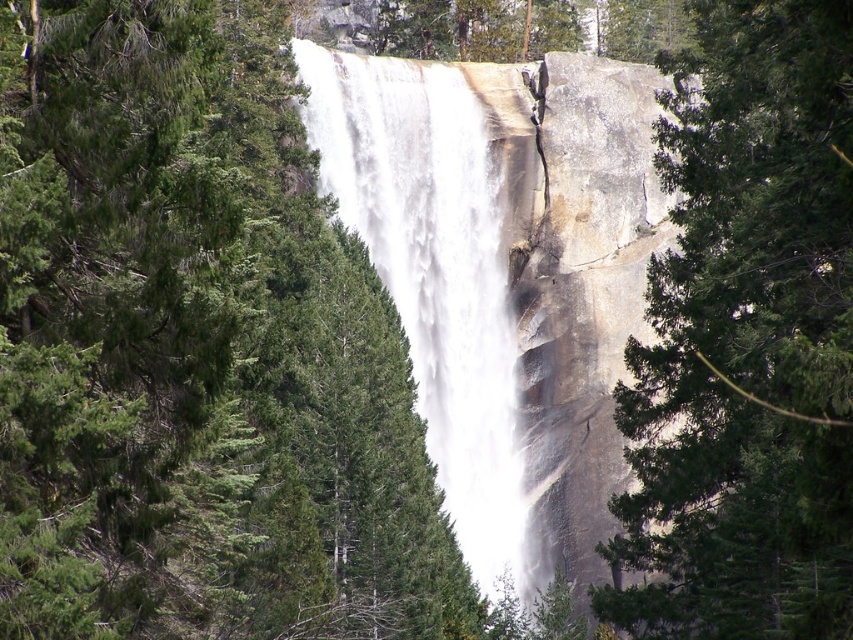
Consider the image. You are standing at the base of the waterfall and want to take a photo. There are two points of interest marked in the scene, point 1 at coordinates point (825, 516) and point 2 at coordinates point (430, 378). Which point should you focus on first if you want to capture the closest subject in your shot?

Point (825, 516) is closer to the camera than point (430, 378), so you should focus on point (825, 516) first to capture the closest subject in your shot.

Based on the photo, you are a photographer standing at the edge of the cliff near the waterfall. You want to capture a photo of the green textured tree at center in the foreground. Based on its 2D location, where should you position the tree in your camera viewfinder?

The green textured tree at center is located at point (746, 339) in the 2D space, which means it should be positioned slightly to the right and near the bottom of the camera viewfinder to capture it in the foreground.

You are a hiker standing at the base of the waterfall. You notice a green textured tree at center and white frothy water at center. Which object is closer to your current position?

The green textured tree at center is closer to your current position because it is located below the white frothy water at center, which is higher up.